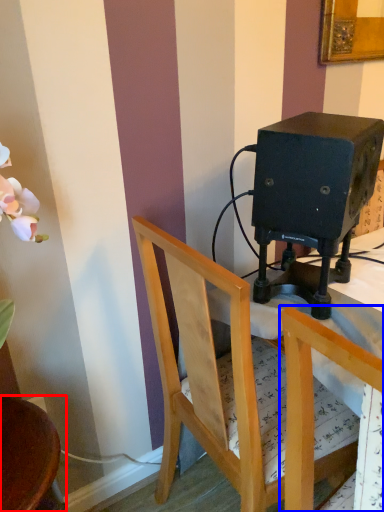
Question: Which point is further to the camera, chair (highlighted by a red box) or chair (highlighted by a blue box)?

Choices:
 (A) chair
 (B) chair

Answer: (A)